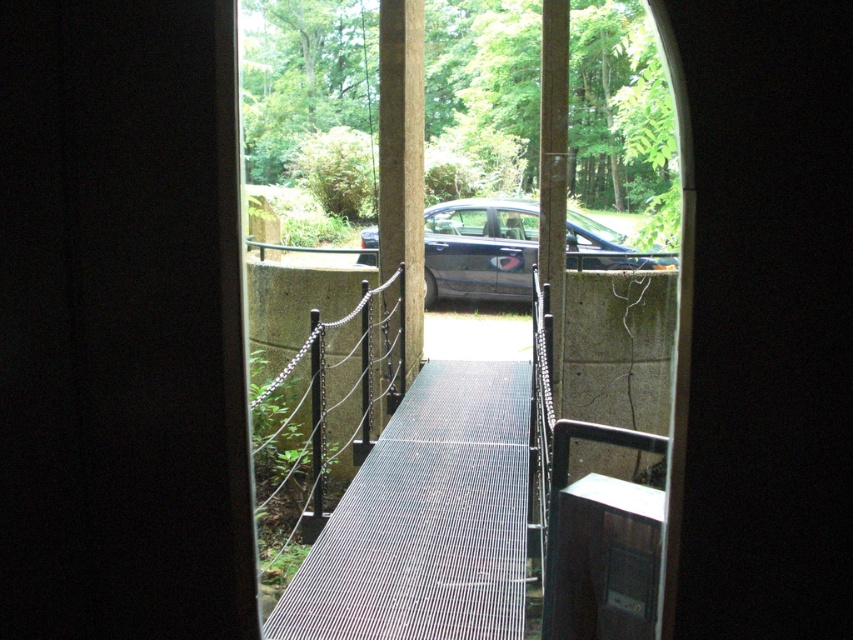
You are standing in the dark interior of the arched doorway and want to walk towards the parked car outside. Which direction should you move relative to the metallic grid walkway at center located at point [427,518]?

You should move towards the metallic grid walkway at center located at point [427,518] because it is positioned near the parked car, which is the destination.

You are standing in the dark interior behind the arched doorway and want to walk to the parked car outside. The metallic grid walkway at center is the only path available. Can you reach the car by walking straight ahead from your current position?

The metallic grid walkway at center is positioned at point (427, 518), which is directly in front of you. Therefore, walking straight ahead will lead you to the parked car through the metallic grid walkway at center.

You are standing inside the dark room and looking through the arched doorway. You see the metallic grid walkway at center and the glossy metallic car at center. Which object is closer to you?

The metallic grid walkway at center is closer to you because it is in front of the glossy metallic car at center.